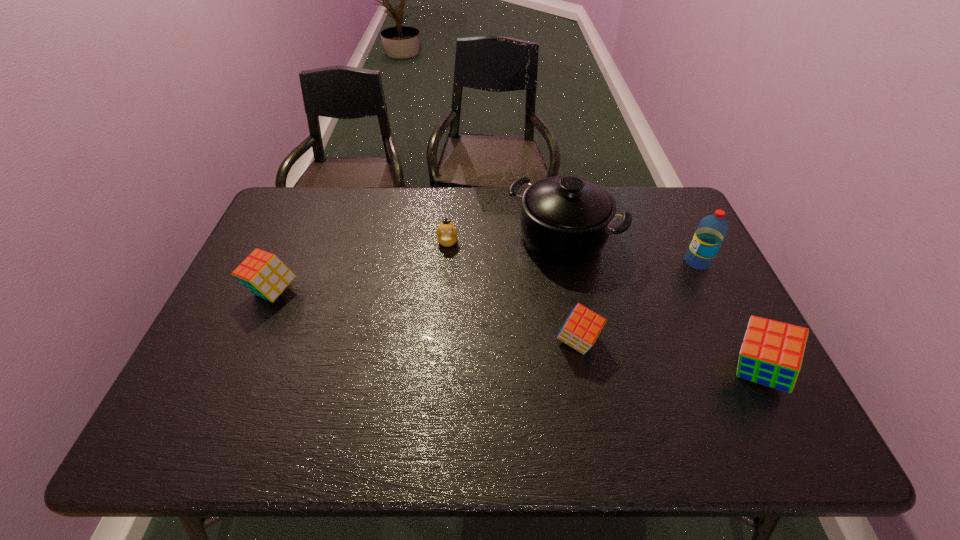
Find the location of a particular element. The height and width of the screenshot is (540, 960). the leftmost object is located at coordinates [264, 274].

The image size is (960, 540). Identify the location of the leftmost cube. (264, 274).

This screenshot has width=960, height=540. What are the coordinates of `the second cube from right to left` in the screenshot? It's located at (580, 331).

In order to click on the rightmost cube in this screenshot , I will do `click(771, 354)`.

You are a GUI agent. You are given a task and a screenshot of the screen. Output one action in this format:
    pyautogui.click(x=<x>, y=<y>)
    Task: Click on the saucepan
    
    Given the screenshot: What is the action you would take?
    pyautogui.click(x=565, y=220)

Find the location of a particular element. The width and height of the screenshot is (960, 540). duckling is located at coordinates (447, 234).

You are a GUI agent. You are given a task and a screenshot of the screen. Output one action in this format:
    pyautogui.click(x=<x>, y=<y>)
    Task: Click on the shortest object
    
    Given the screenshot: What is the action you would take?
    pyautogui.click(x=447, y=234)

Find the location of `water bottle`. water bottle is located at coordinates point(712,229).

Locate an element on the screen. free space located 0.330m on the right of the third nearest object is located at coordinates (419, 292).

I want to click on free spot located on the left of the shortest cube, so click(536, 342).